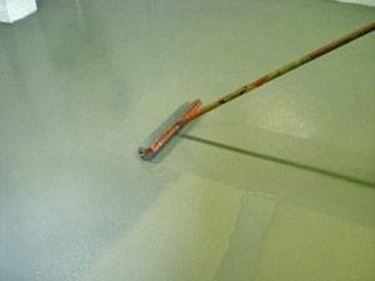
This screenshot has height=281, width=375. In order to click on broom body in this screenshot , I will do `click(175, 126)`.